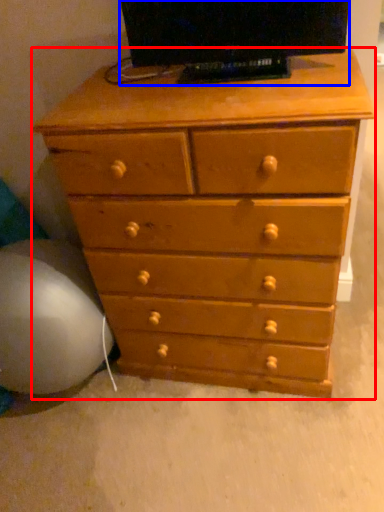
Question: Which object is further to the camera taking this photo, chest of drawers (highlighted by a red box) or television (highlighted by a blue box)?

Choices:
 (A) chest of drawers
 (B) television

Answer: (B)